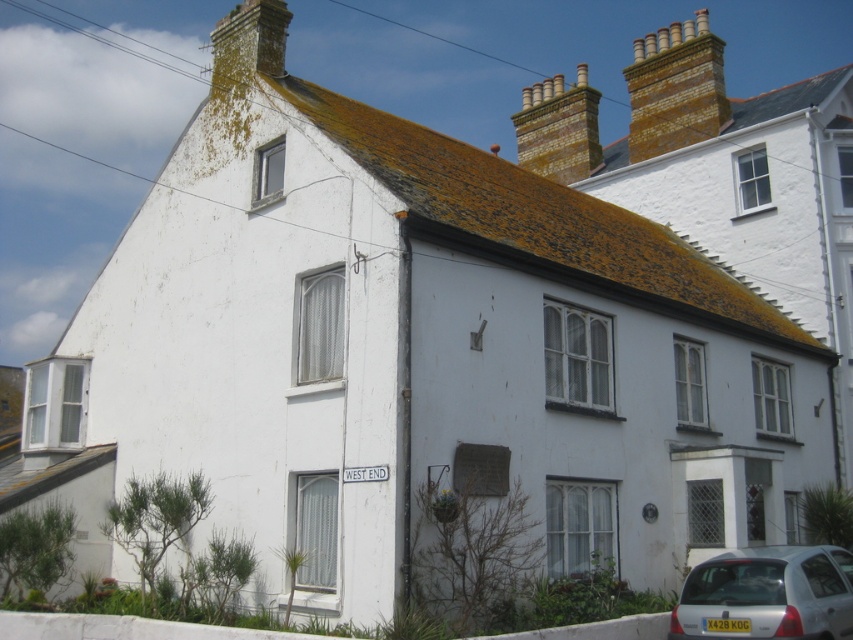
Between point (723, 108) and point (788, 552), which one is positioned in front?

Positioned in front is point (788, 552).

Based on the photo, does white painted brick cottage at upper right appear over silver metallic car at lower right?

Correct, white painted brick cottage at upper right is located above silver metallic car at lower right.

Who is more distant from viewer, (805,228) or (762,605)?

The point (805,228) is behind.

Image resolution: width=853 pixels, height=640 pixels. In order to click on white painted brick cottage at upper right in this screenshot , I will do `click(722, 177)`.